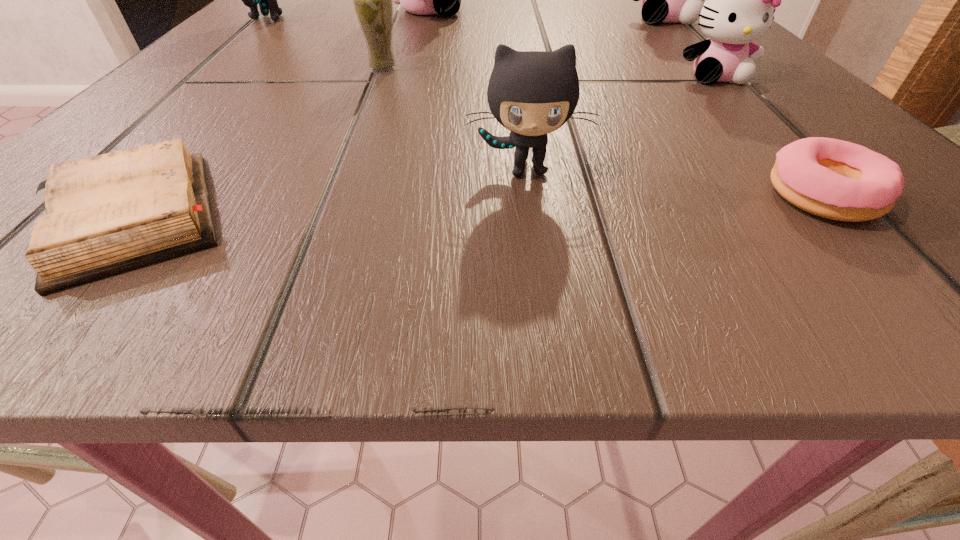
Locate an element on the screen. This screenshot has height=540, width=960. object identified as the closest to the smallest white kitten is located at coordinates (665, 0).

Locate an element on the screen. the closest object to the biggest white kitten is located at coordinates (267, 0).

Point out which kitten is positioned as the nearest to the straw for drinking. Please provide its 2D coordinates. Your answer should be formatted as a tuple, i.e. [(x, y)], where the tuple contains the x and y coordinates of a point satisfying the conditions above.

[(445, 0)]

Identify the location of kitten that is the closest one to the fourth kitten from right to left. (267, 0).

Choose which white kitten is the second nearest neighbor to the left gray kitten. Please provide its 2D coordinates. Your answer should be formatted as a tuple, i.e. [(x, y)], where the tuple contains the x and y coordinates of a point satisfying the conditions above.

[(665, 0)]

You are a GUI agent. You are given a task and a screenshot of the screen. Output one action in this format:
    pyautogui.click(x=<x>, y=<y>)
    Task: Click on the white kitten that stands as the closest to the nearest white kitten
    The height and width of the screenshot is (540, 960).
    Given the screenshot: What is the action you would take?
    pyautogui.click(x=665, y=0)

The image size is (960, 540). In order to click on vacant space that satisfies the following two spatial constraints: 1. on the front side of the yellow straw for drinking; 2. on the right side of the pink doughnut in this screenshot , I will do `click(333, 197)`.